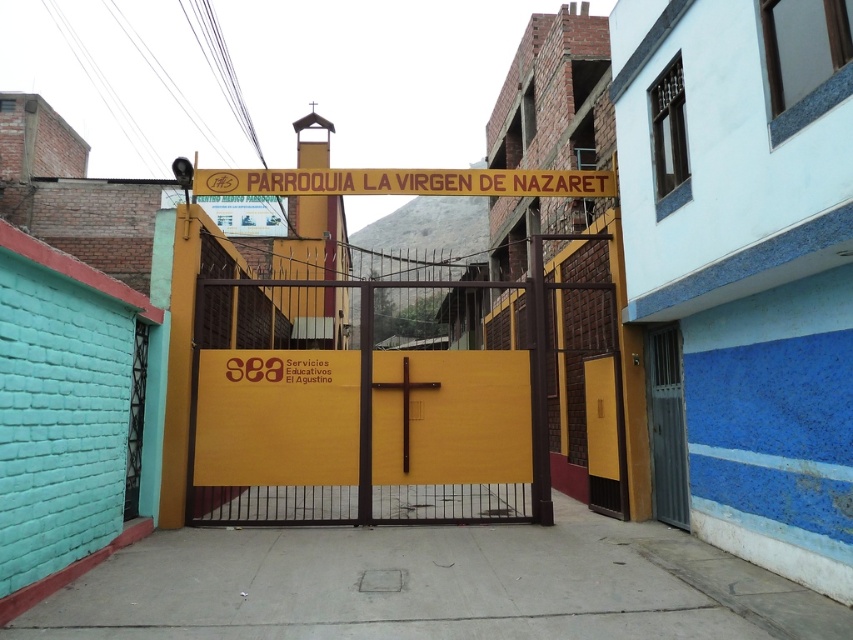
Question: Can you confirm if yellow matte signboard at upper center is bigger than matte yellow door at right?

Choices:
 (A) no
 (B) yes

Answer: (A)

Question: Which point appears farthest from the camera in this image?

Choices:
 (A) (674, 348)
 (B) (451, 362)
 (C) (608, 380)
 (D) (550, 186)

Answer: (D)

Question: Estimate the real-world distances between objects in this image. Which object is farther from the yellow matte sign at center?

Choices:
 (A) yellow matte signboard at upper center
 (B) metallic gray door at right
 (C) matte yellow door at right

Answer: (A)

Question: Is yellow matte signboard at upper center smaller than matte yellow door at right?

Choices:
 (A) no
 (B) yes

Answer: (B)

Question: Can you confirm if metallic gray door at right is positioned below matte yellow door at right?

Choices:
 (A) yes
 (B) no

Answer: (B)

Question: Which point is farther to the camera?

Choices:
 (A) matte yellow door at right
 (B) yellow matte sign at center
 (C) metallic gray door at right

Answer: (A)